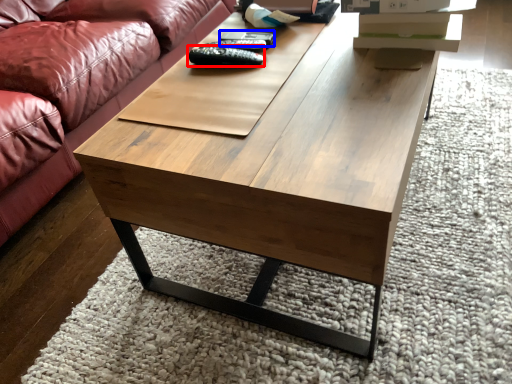
Question: Which of the following is the farthest to the observer, remote (highlighted by a red box) or remote (highlighted by a blue box)?

Choices:
 (A) remote
 (B) remote

Answer: (B)